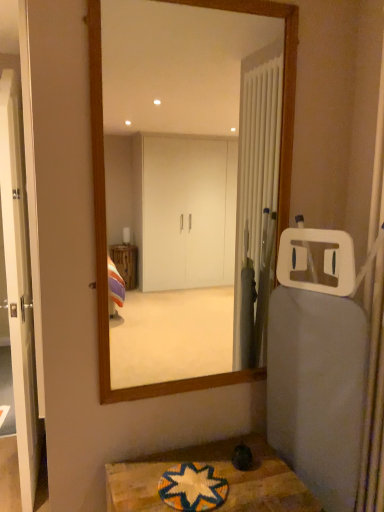
The image size is (384, 512). Find the location of `multicolored woven mat at lower center`. multicolored woven mat at lower center is located at coordinates (192, 488).

Measure the distance between wooden textured table at lower center and camera.

wooden textured table at lower center and camera are 3.90 feet apart.

What do you see at coordinates (217, 474) in the screenshot? The height and width of the screenshot is (512, 384). I see `wooden textured table at lower center` at bounding box center [217, 474].

Where is `multicolored woven mat at lower center`? The height and width of the screenshot is (512, 384). multicolored woven mat at lower center is located at coordinates (192, 488).

From a real-world perspective, is white glossy door at left located higher than wooden textured table at lower center?

Indeed, from a real-world perspective, white glossy door at left stands above wooden textured table at lower center.

Could wooden textured table at lower center be considered to be inside white glossy door at left?

No, wooden textured table at lower center is not surrounded by white glossy door at left.

Considering the relative positions of white glossy door at left and wooden textured table at lower center in the image provided, is white glossy door at left in front of wooden textured table at lower center?

No, white glossy door at left is behind wooden textured table at lower center.

You are a GUI agent. You are given a task and a screenshot of the screen. Output one action in this format:
    pyautogui.click(x=<x>, y=<y>)
    Task: Click on the bath mat beneath the wooden framed mirror at center (from a real-world perspective)
    The image size is (384, 512).
    Given the screenshot: What is the action you would take?
    pyautogui.click(x=192, y=488)

Does wooden framed mirror at center have a lesser height compared to multicolored woven mat at lower center?

In fact, wooden framed mirror at center may be taller than multicolored woven mat at lower center.

Looking at their sizes, would you say wooden framed mirror at center is wider or thinner than multicolored woven mat at lower center?

Clearly, wooden framed mirror at center has less width compared to multicolored woven mat at lower center.

Between white glossy door at left and wooden framed mirror at center, which one has more height?

white glossy door at left is taller.

Would you consider white glossy door at left to be distant from wooden framed mirror at center?

white glossy door at left is far away from wooden framed mirror at center.

Would you say white glossy door at left contains wooden framed mirror at center?

No, wooden framed mirror at center is not surrounded by white glossy door at left.

From a real-world perspective, which object stands above the other?

From a 3D spatial view, wooden framed mirror at center is above.

Does wooden textured table at lower center have a larger size compared to white glossy door at left?

No, wooden textured table at lower center is not bigger than white glossy door at left.

Find the location of a particular element. This screenshot has width=384, height=512. door above the wooden textured table at lower center (from the image's perspective) is located at coordinates click(x=18, y=286).

From a real-world perspective, which is physically above, wooden textured table at lower center or white glossy door at left?

In real-world perspective, white glossy door at left is above.

Does wooden textured table at lower center have a lesser height compared to multicolored woven mat at lower center?

Incorrect, the height of wooden textured table at lower center does not fall short of that of multicolored woven mat at lower center.

In terms of size, does wooden textured table at lower center appear bigger or smaller than multicolored woven mat at lower center?

wooden textured table at lower center is bigger than multicolored woven mat at lower center.

Where is `bath mat lying above the wooden textured table at lower center (from the image's perspective)`? Image resolution: width=384 pixels, height=512 pixels. bath mat lying above the wooden textured table at lower center (from the image's perspective) is located at coordinates (192, 488).

What's the angular difference between wooden textured table at lower center and multicolored woven mat at lower center's facing directions?

They differ by 0.00162 degrees in their facing directions.

Between multicolored woven mat at lower center and wooden textured table at lower center, which one appears on the left side from the viewer's perspective?

multicolored woven mat at lower center.

Does multicolored woven mat at lower center turn towards wooden textured table at lower center?

Yes.

From the image's perspective, is multicolored woven mat at lower center located above wooden textured table at lower center?

Indeed, from the image's perspective, multicolored woven mat at lower center is shown above wooden textured table at lower center.

Between multicolored woven mat at lower center and wooden textured table at lower center, which one has less height?

multicolored woven mat at lower center.

Is multicolored woven mat at lower center far away from white glossy door at left?

Yes.

Which point is more distant from viewer, (205, 467) or (17, 353)?

The point (17, 353) is behind.

Is multicolored woven mat at lower center aimed at white glossy door at left?

No, multicolored woven mat at lower center is not aimed at white glossy door at left.

Which object is wider, multicolored woven mat at lower center or white glossy door at left?

multicolored woven mat at lower center is wider.

The width and height of the screenshot is (384, 512). I want to click on table that appears below the white glossy door at left (from the image's perspective), so click(x=217, y=474).

The height and width of the screenshot is (512, 384). What are the coordinates of `bath mat in front of the wooden framed mirror at center` in the screenshot? It's located at (192, 488).

Estimate the real-world distances between objects in this image. Which object is further from wooden textured table at lower center, wooden framed mirror at center or multicolored woven mat at lower center?

Among the two, wooden framed mirror at center is located further to wooden textured table at lower center.

Based on their spatial positions, is wooden framed mirror at center or multicolored woven mat at lower center further from white glossy door at left?

wooden framed mirror at center is further to white glossy door at left.

From the image, which object appears to be nearer to wooden textured table at lower center, white glossy door at left or wooden framed mirror at center?

white glossy door at left lies closer to wooden textured table at lower center than the other object.

When comparing their distances from white glossy door at left, does wooden textured table at lower center or wooden framed mirror at center seem closer?

wooden textured table at lower center is closer to white glossy door at left.

Looking at the image, which one is located closer to wooden textured table at lower center, multicolored woven mat at lower center or white glossy door at left?

multicolored woven mat at lower center.

Looking at this image, from the image, which object appears to be farther from wooden framed mirror at center, multicolored woven mat at lower center or white glossy door at left?

multicolored woven mat at lower center is further to wooden framed mirror at center.

Which object lies nearer to the anchor point white glossy door at left, multicolored woven mat at lower center or wooden framed mirror at center?

multicolored woven mat at lower center is closer to white glossy door at left.

Considering their positions, is wooden textured table at lower center positioned closer to wooden framed mirror at center than white glossy door at left?

white glossy door at left is positioned closer to the anchor wooden framed mirror at center.

The width and height of the screenshot is (384, 512). In order to click on bath mat between white glossy door at left and wooden textured table at lower center from left to right in this screenshot , I will do `click(192, 488)`.

In order to click on bath mat between wooden framed mirror at center and wooden textured table at lower center vertically in this screenshot , I will do `click(192, 488)`.

Find the location of `door between wooden framed mirror at center and wooden textured table at lower center in the up-down direction`. door between wooden framed mirror at center and wooden textured table at lower center in the up-down direction is located at coordinates (18, 286).

Identify the location of bath mat between white glossy door at left and wooden framed mirror at center from left to right. (192, 488).